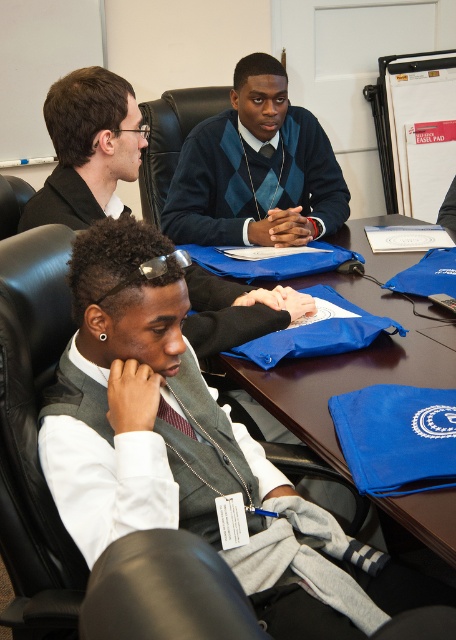
Does dark blue argyle sweater at center appear under gray vest at center?

No, dark blue argyle sweater at center is not below gray vest at center.

Does dark blue argyle sweater at center appear over gray vest at center?

Yes, dark blue argyle sweater at center is above gray vest at center.

Find the location of `dark blue argyle sweater at center`. dark blue argyle sweater at center is located at coordinates (x=255, y=170).

Find the location of a particular element. dark blue argyle sweater at center is located at coordinates (255, 170).

Is dark blue argyle sweater at center bigger than blue fabric bag at center?

Actually, dark blue argyle sweater at center might be smaller than blue fabric bag at center.

Who is higher up, dark blue argyle sweater at center or blue fabric bag at center?

dark blue argyle sweater at center

Describe the element at coordinates (255, 170) in the screenshot. This screenshot has height=640, width=456. I see `dark blue argyle sweater at center` at that location.

At what (x,y) coordinates should I click in order to perform the action: click on dark blue argyle sweater at center. Please return your answer as a coordinate pair (x, y). Looking at the image, I should click on (255, 170).

Is blue fabric bag at center further to the viewer compared to striped fabric tie at center?

No, it is not.

Can you confirm if blue fabric bag at center is wider than striped fabric tie at center?

Correct, the width of blue fabric bag at center exceeds that of striped fabric tie at center.

Is point (376, 355) more distant than point (161, 406)?

Yes, it is behind point (161, 406).

Where is `blue fabric bag at center`? The height and width of the screenshot is (640, 456). blue fabric bag at center is located at coordinates (348, 365).